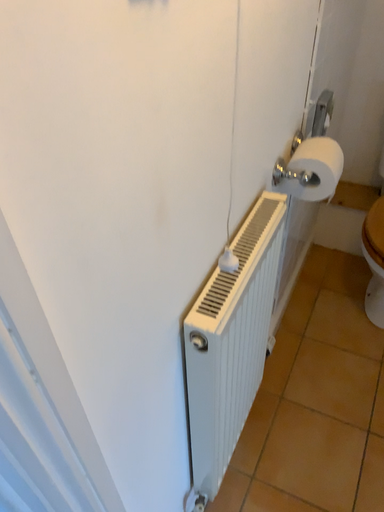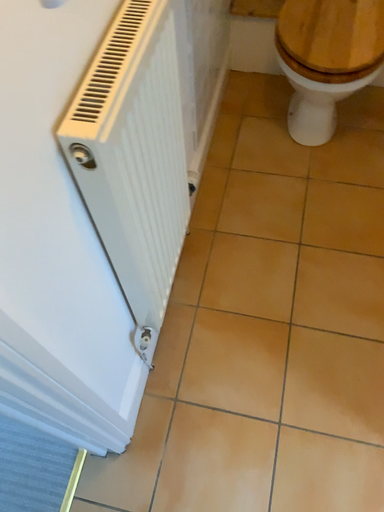
Question: How did the camera likely rotate when shooting the video?

Choices:
 (A) rotated upward
 (B) rotated downward

Answer: (B)